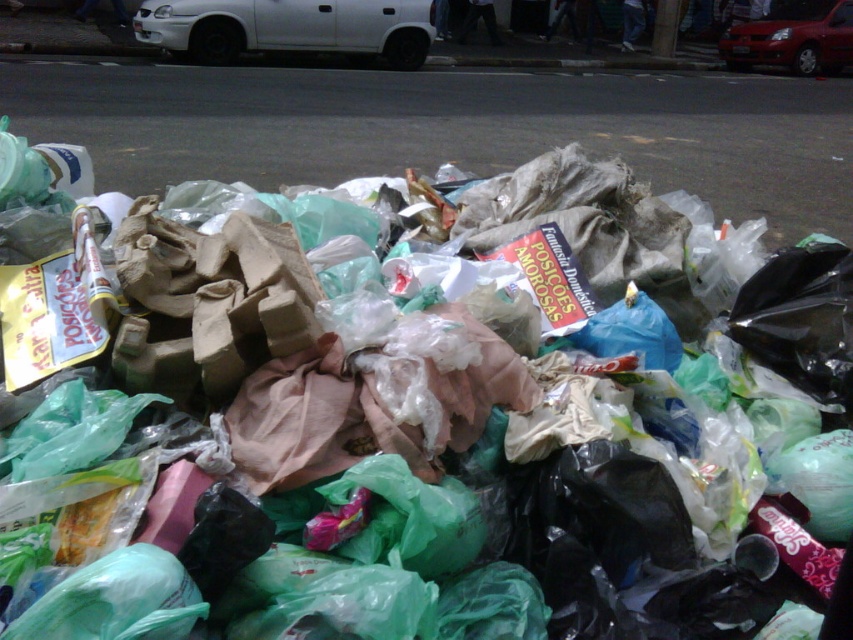
Is point (320, 42) positioned behind point (792, 12)?

That is False.

Where is `white matte car at upper left`? The height and width of the screenshot is (640, 853). white matte car at upper left is located at coordinates (288, 28).